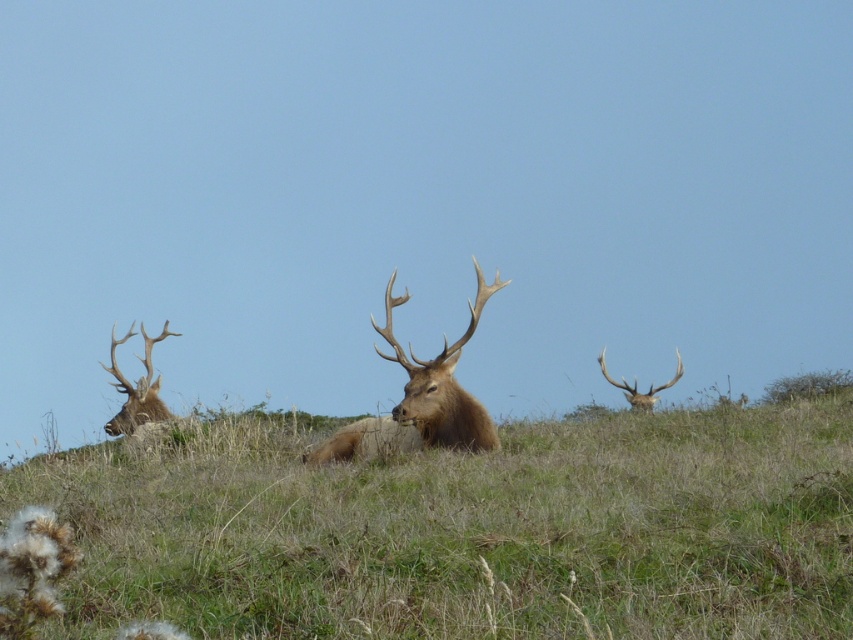
Is the position of green grass at center more distant than that of brown velvet antler at upper right?

No, it is not.

Can you confirm if green grass at center is wider than brown velvet antler at upper right?

Incorrect, green grass at center's width does not surpass brown velvet antler at upper right's.

Between point (225, 621) and point (647, 396), which one is positioned behind?

Point (647, 396)

Identify the location of green grass at center. The height and width of the screenshot is (640, 853). (469, 531).

Is point (448, 436) farther from viewer compared to point (152, 394)?

No, (448, 436) is closer to viewer.

Between point (408, 346) and point (134, 396), which one is positioned behind?

Point (134, 396)

Is point (482, 410) in front of point (125, 426)?

Yes.

Identify the location of brown velvet antler at center. (440, 384).

Which is in front, point (660, 532) or point (491, 285)?

Positioned in front is point (660, 532).

Who is taller, green grass at center or brown velvet antler at center?

brown velvet antler at center

Measure the distance between green grass at center and camera.

green grass at center and camera are 5.93 meters apart from each other.

This screenshot has height=640, width=853. Find the location of `green grass at center`. green grass at center is located at coordinates (469, 531).